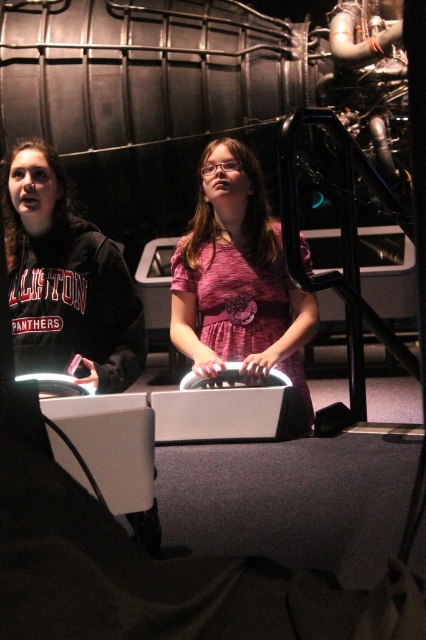
You are standing in the futuristic environment and see the pink fabric dress at center and the matte black hoodie at left. Which object is positioned to the right of the other?

The pink fabric dress at center is to the right of the matte black hoodie at left.

In the scene shown: You are a photographer positioned in front of the scene. You want to capture a clear photo of the pink fabric dress at center without any obstruction. Given that the matte black hoodie at left is blocking part of the view, can you adjust your position to take the photo? Explain your reasoning.

The matte black hoodie at left is behind the pink fabric dress at center, so adjusting your position slightly forward or sideways might allow you to capture the pink fabric dress at center without obstruction from the hoodie.